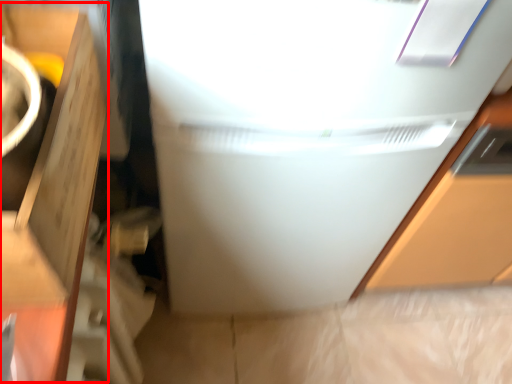
Question: From the image's perspective, what is the correct spatial positioning of cardboard box (annotated by the red box) in reference to refrigerator?

Choices:
 (A) above
 (B) below

Answer: (B)